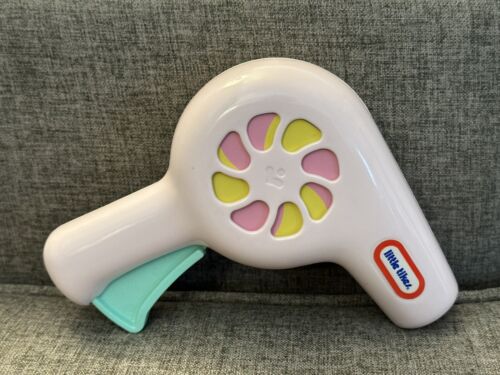
Where is `white plastic toy hair dryer`? white plastic toy hair dryer is located at coordinates (253, 92).